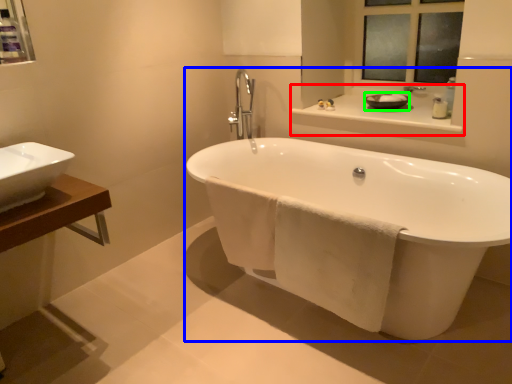
Question: Considering the real-world distances, which object is farthest from counter top (highlighted by a red box)? bathtub (highlighted by a blue box) or basin (highlighted by a green box)?

Choices:
 (A) bathtub
 (B) basin

Answer: (A)